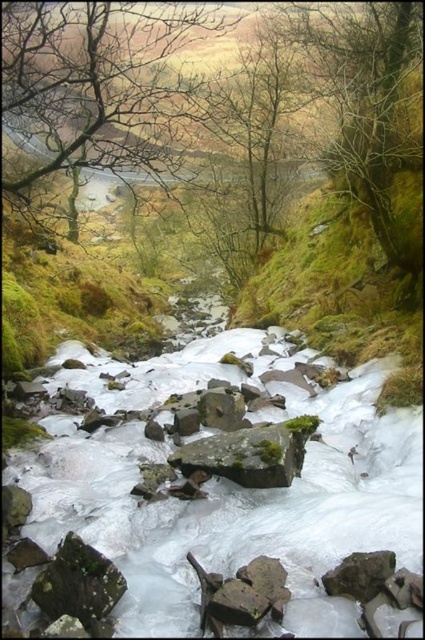
Question: Which point is farther to the camera?

Choices:
 (A) (320, 548)
 (B) (354, 72)

Answer: (B)

Question: Among these objects, which one is nearest to the camera?

Choices:
 (A) gray/rough stone at center
 (B) brown leafless tree at upper left

Answer: (B)

Question: Can you confirm if brown leafless tree at upper left is smaller than green mossy rock at center?

Choices:
 (A) no
 (B) yes

Answer: (A)

Question: Does green mossy tree at right appear over gray rough rock at lower right?

Choices:
 (A) yes
 (B) no

Answer: (A)

Question: Can you confirm if green mossy tree at right is positioned below mossy gray rock at lower left?

Choices:
 (A) no
 (B) yes

Answer: (A)

Question: Estimate the real-world distances between objects in this image. Which object is closer to the mossy gray rock at lower left?

Choices:
 (A) gray/rough stone at center
 (B) green mossy tree at right
 (C) green mossy rock at center
 (D) white frosty rocks at center

Answer: (D)